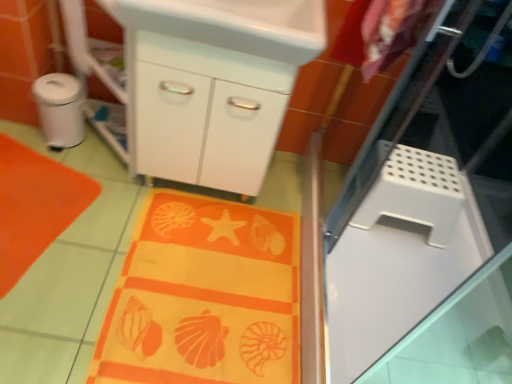
This screenshot has width=512, height=384. I want to click on vacant space situated above orange fabric at lower center (from a real-world perspective), so click(208, 282).